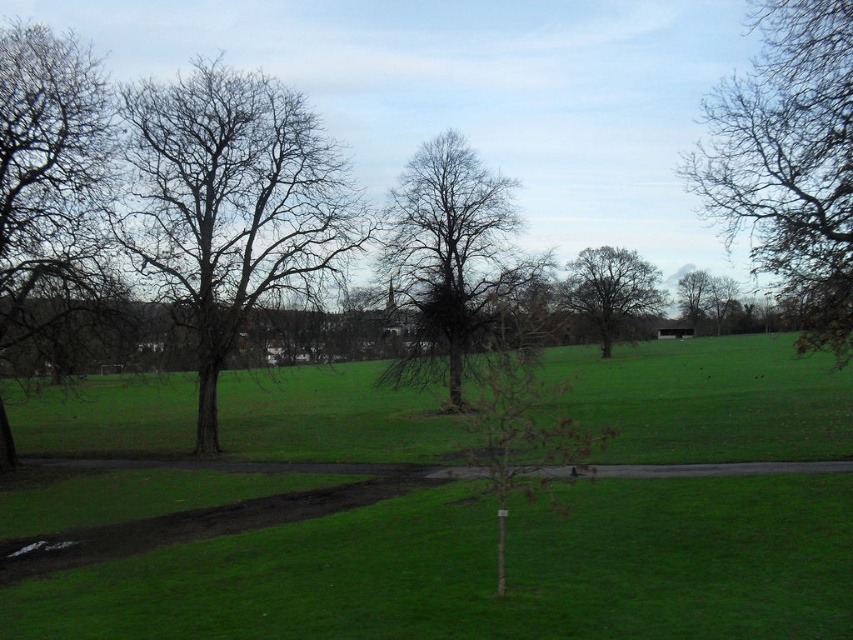
Does bare branches tree at left appear over brown leafless tree at center?

Correct, bare branches tree at left is located above brown leafless tree at center.

Which of these two, bare branches tree at left or brown leafless tree at center, stands taller?

bare branches tree at left is taller.

Describe the element at coordinates (229, 204) in the screenshot. I see `bare branches tree at left` at that location.

This screenshot has height=640, width=853. I want to click on bare branches tree at left, so click(x=229, y=204).

Does point (10, 204) come behind point (467, 205)?

No.

Who is more forward, (15, 140) or (469, 250)?

Point (15, 140)

What do you see at coordinates (49, 180) in the screenshot? I see `bare branches at left` at bounding box center [49, 180].

I want to click on bare branches at left, so click(x=49, y=180).

Can you confirm if bare branches tree at center is thinner than brown leafless tree at center?

Correct, bare branches tree at center's width is less than brown leafless tree at center's.

Measure the distance from bare branches tree at center to brown leafless tree at center.

The distance of bare branches tree at center from brown leafless tree at center is 87.17 feet.

Locate an element on the screen. bare branches tree at center is located at coordinates [451, 260].

Identify the location of bare branches tree at center. (451, 260).